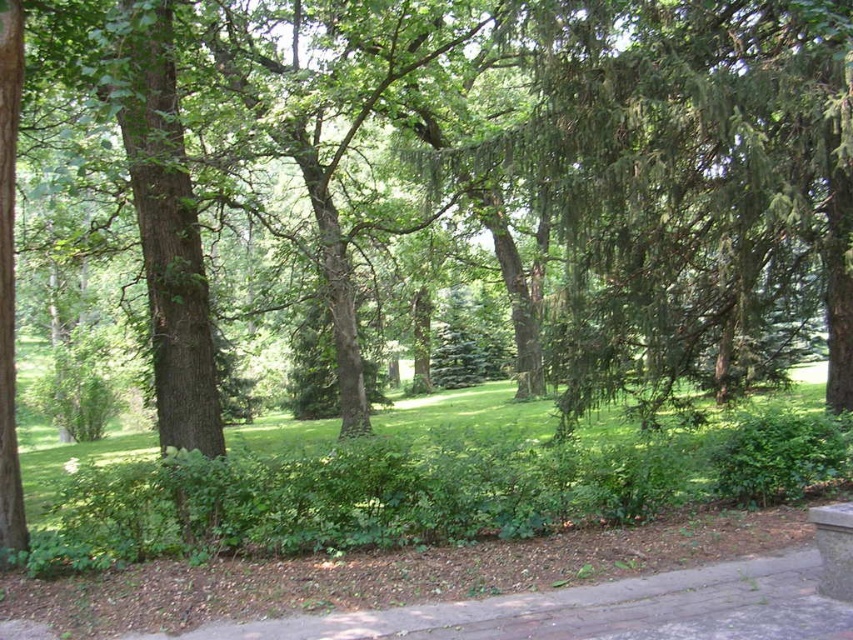
Locate an element on the screen. green leafy grass at center is located at coordinates (431, 486).

Does green leafy grass at center have a larger size compared to brown brick pavement at lower center?

Indeed, green leafy grass at center has a larger size compared to brown brick pavement at lower center.

Is point (234, 499) positioned in front of point (701, 605)?

No, it is not.

At what (x,y) coordinates should I click in order to perform the action: click on green leafy grass at center. Please return your answer as a coordinate pair (x, y). Looking at the image, I should click on (431, 486).